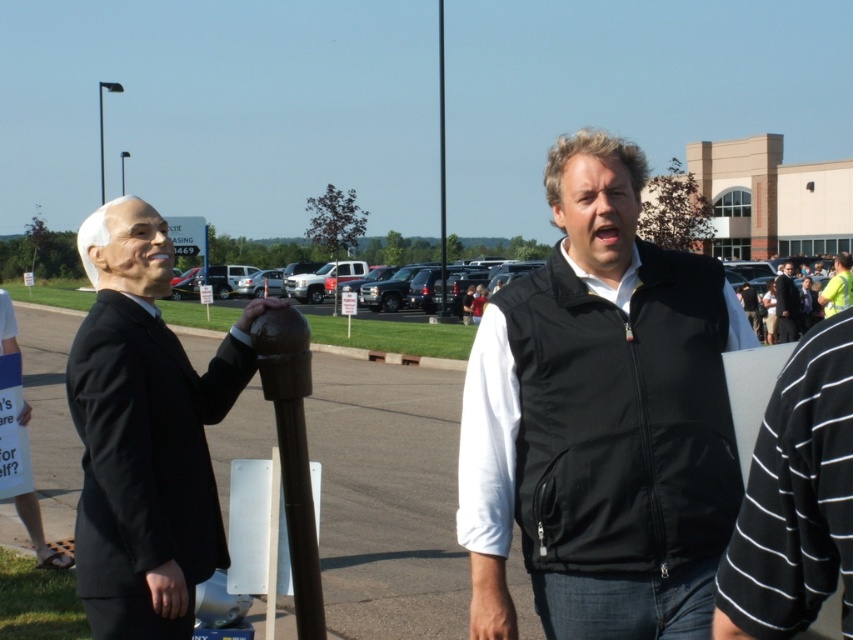
You are a photographer trying to capture a shot of the black softshell vest at center. The camera you are using has a focal length of 50mm and an aperture of f2.8. Based on the scene description, can you determine if the vest is within the camera frame?

The black softshell vest at center is located at point (601,420) in the image, which is within the standard camera frame dimensions. Therefore, the vest should be visible in the shot.

You are a delivery person who needs to place a small package between the matte black suit at left and the brown wooden pole at center. Based on their sizes, which object should you place the package closer to?

The matte black suit at left has a smaller size compared to the brown wooden pole at center, so you should place the package closer to the brown wooden pole at center to ensure there is enough space.

You are standing in the parking lot and want to place a 1.5 meter tall box between the matte black suit at left and the brown wooden pole at center. Can the box fit vertically between them?

The matte black suit at left is shorter than the brown wooden pole at center, but the exact vertical space between them isn